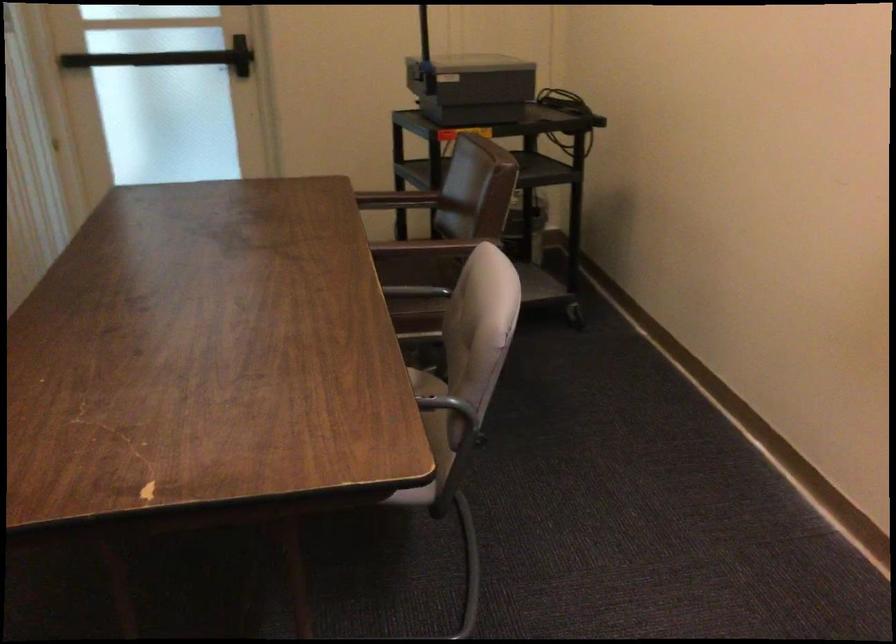
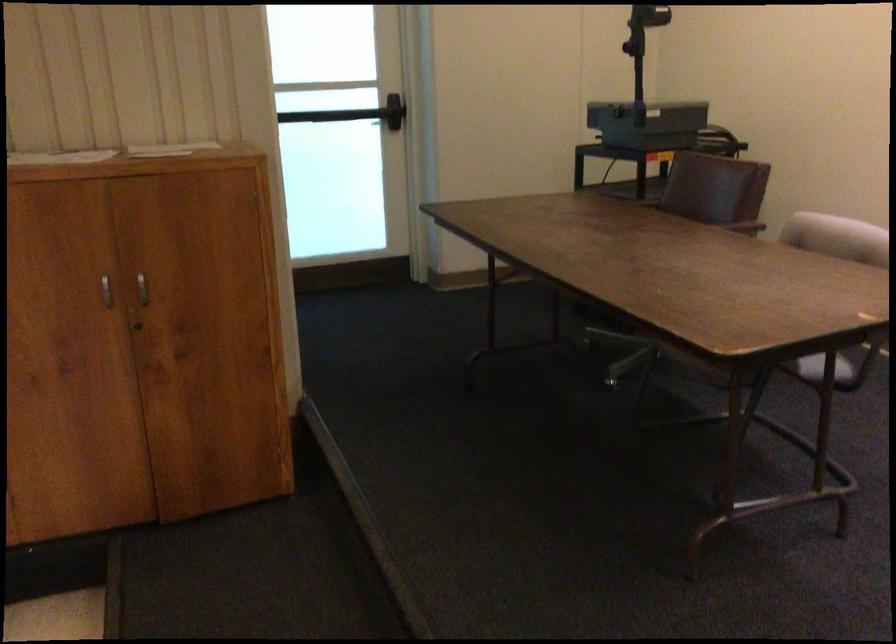
In the second image, find the point that corresponds to point 471,240 in the first image.

(739, 223)